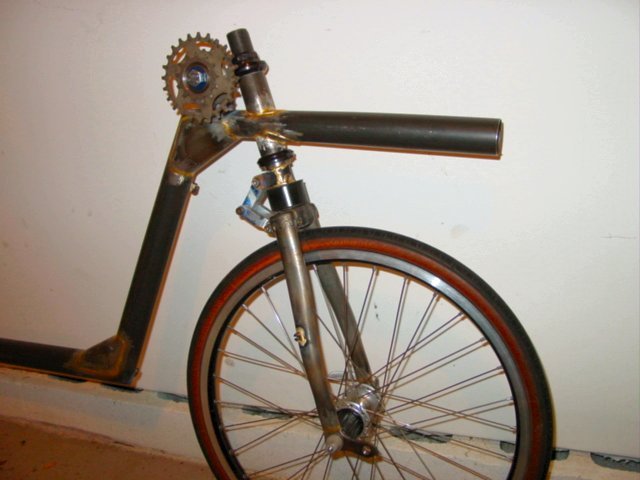
Locate an element on the screen. The height and width of the screenshot is (480, 640). brown floor is located at coordinates (118, 463).